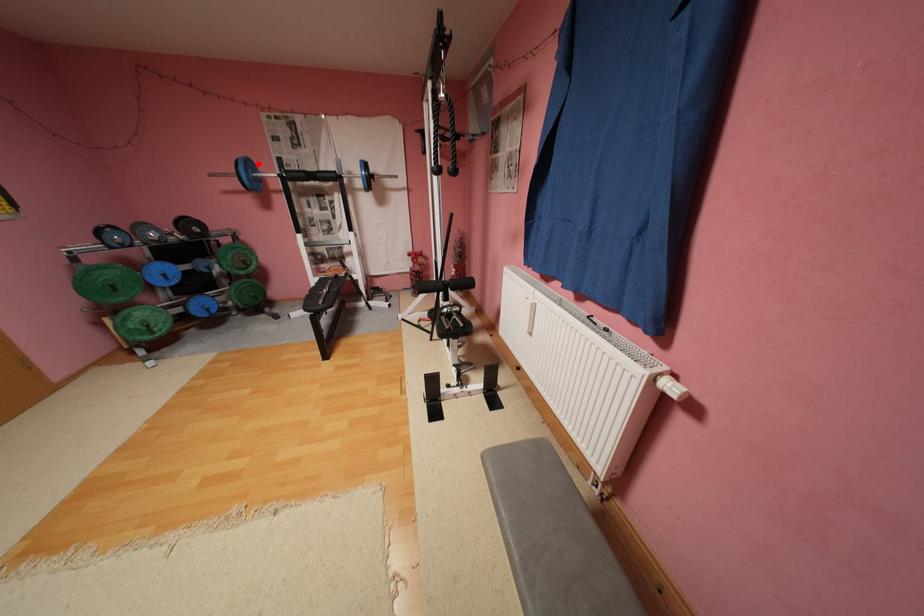
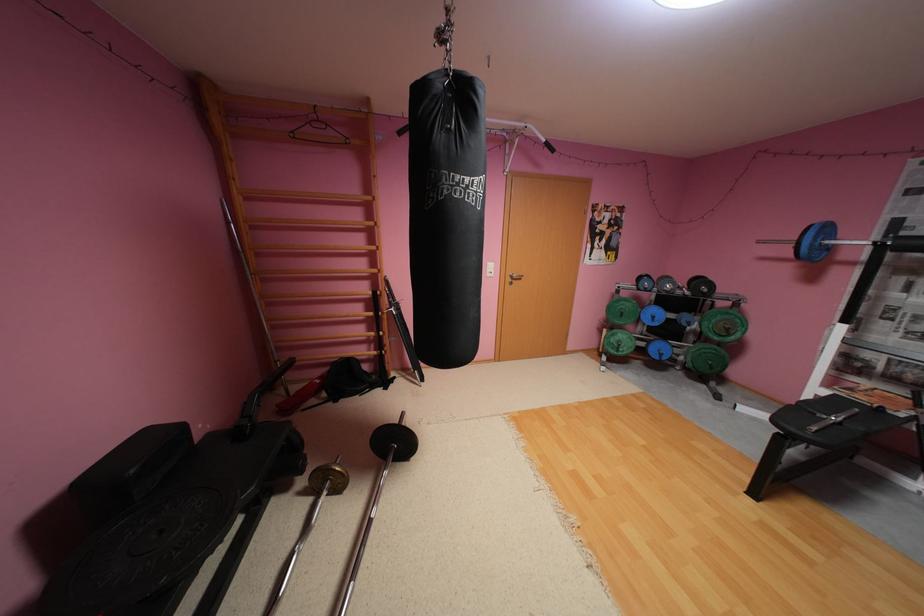
Find the pixel in the second image that matches the highlighted location in the first image.

(835, 229)